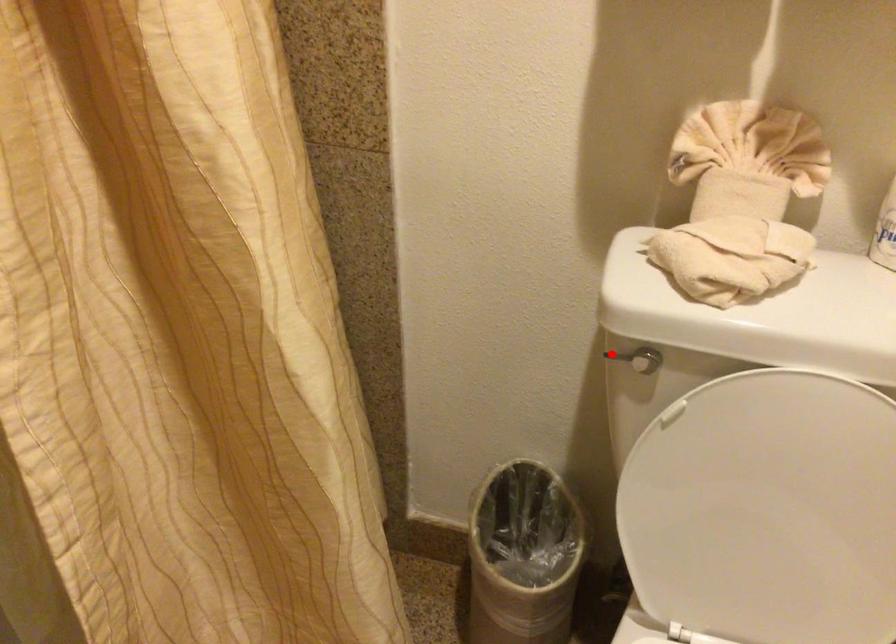
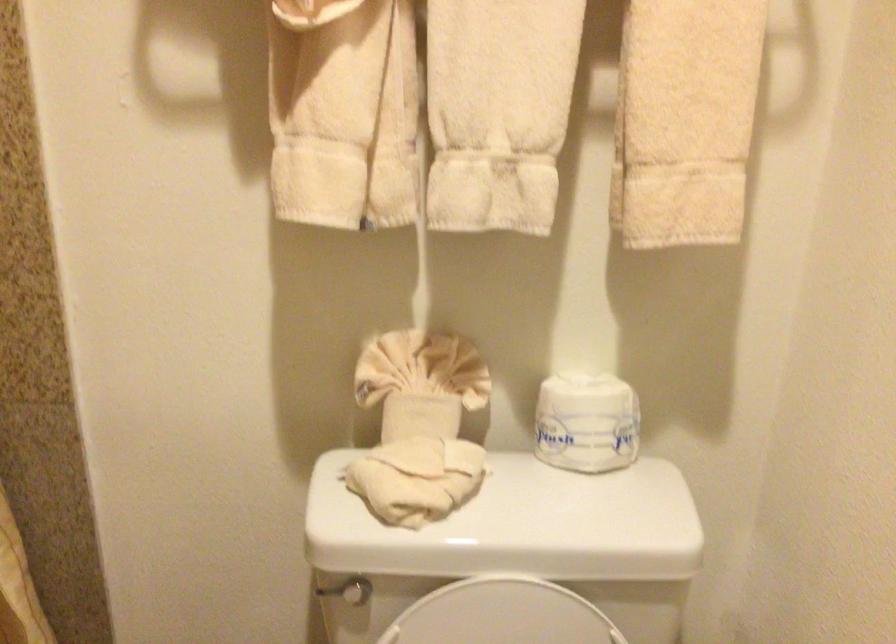
Find the pixel in the second image that matches the highlighted location in the first image.

(326, 590)